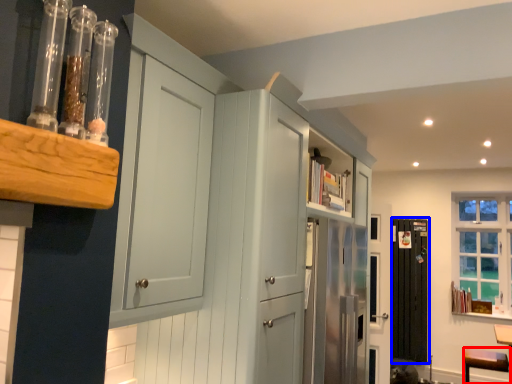
Question: Among these objects, which one is nearest to the camera, vanity (highlighted by a red box) or screen door (highlighted by a blue box)?

Choices:
 (A) vanity
 (B) screen door

Answer: (A)